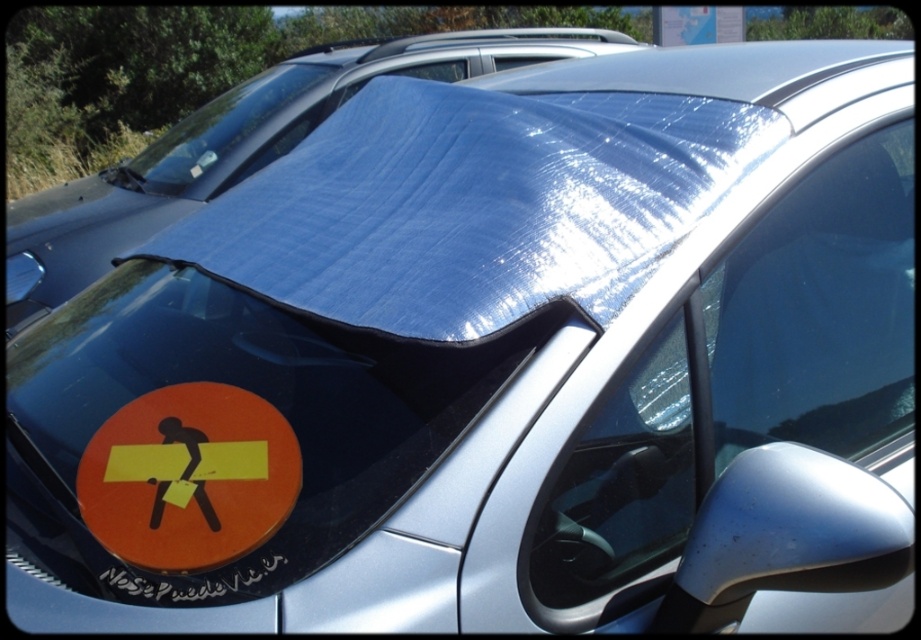
Question: Is transparent plastic windshield at center thinner than blue reflective tarp at center?

Choices:
 (A) no
 (B) yes

Answer: (B)

Question: Is transparent plastic windshield at center smaller than blue reflective tarp at center?

Choices:
 (A) no
 (B) yes

Answer: (B)

Question: Which of the following is the closest to the observer?

Choices:
 (A) orange matte sticker at lower left
 (B) transparent plastic windshield at center

Answer: (B)

Question: Among these objects, which one is farthest from the camera?

Choices:
 (A) orange matte sticker at lower left
 (B) transparent plastic windshield at center
 (C) transparent plastic windshield at upper center

Answer: (C)

Question: Is orange matte sticker at lower left below transparent plastic windshield at upper center?

Choices:
 (A) no
 (B) yes

Answer: (B)

Question: Estimate the real-world distances between objects in this image. Which object is closer to the orange matte sticker at lower left?

Choices:
 (A) transparent plastic windshield at center
 (B) blue reflective tarp at center

Answer: (A)